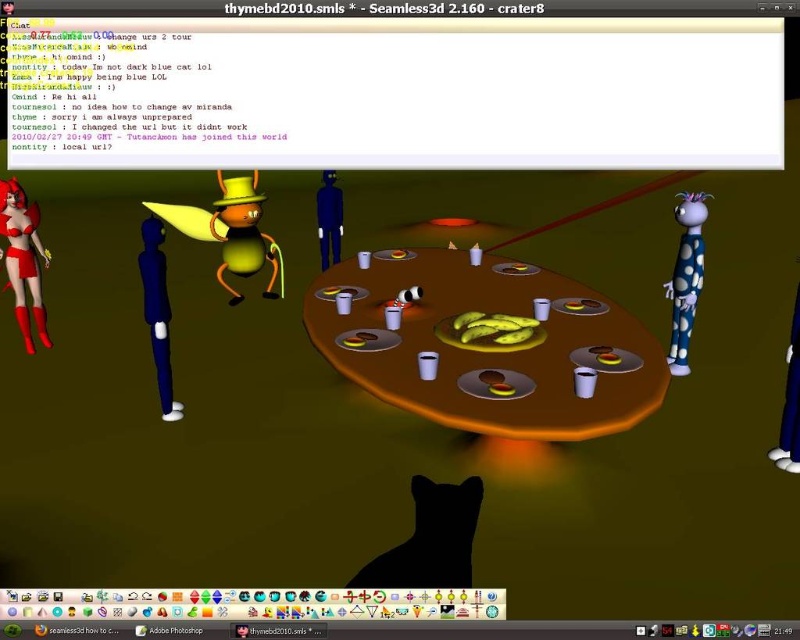
You are a character in this virtual environment and want to send a message to another player. Where exactly on the screen should you click to open the transparent plastic chat window at upper center?

The transparent plastic chat window at upper center is located at the coordinates point [394,92] on the screen, so you should click there to open it.

You are navigating a virtual environment in Seamless3D and need to locate the transparent plastic chat window at upper center. Given that the coordinate system starts at the bottom left corner of the screen, can you determine its position relative to the bottom edge of the screen?

The transparent plastic chat window at upper center is located at point coordinates 0.145 on the x and 0.494 on the y. Since the coordinate system starts at the bottom left, the y value of 0.494 indicates it is approximately 49.4 percent from the bottom edge of the screen.